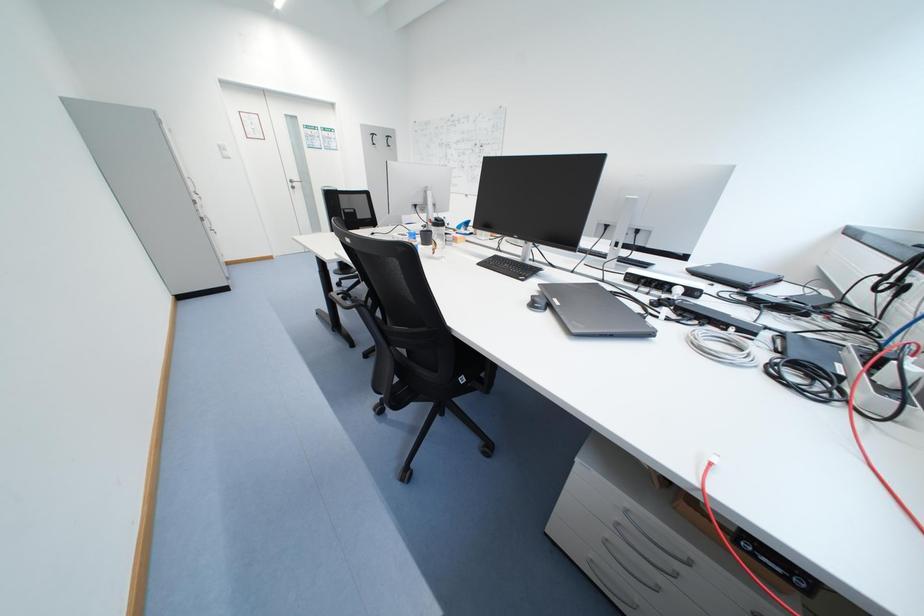
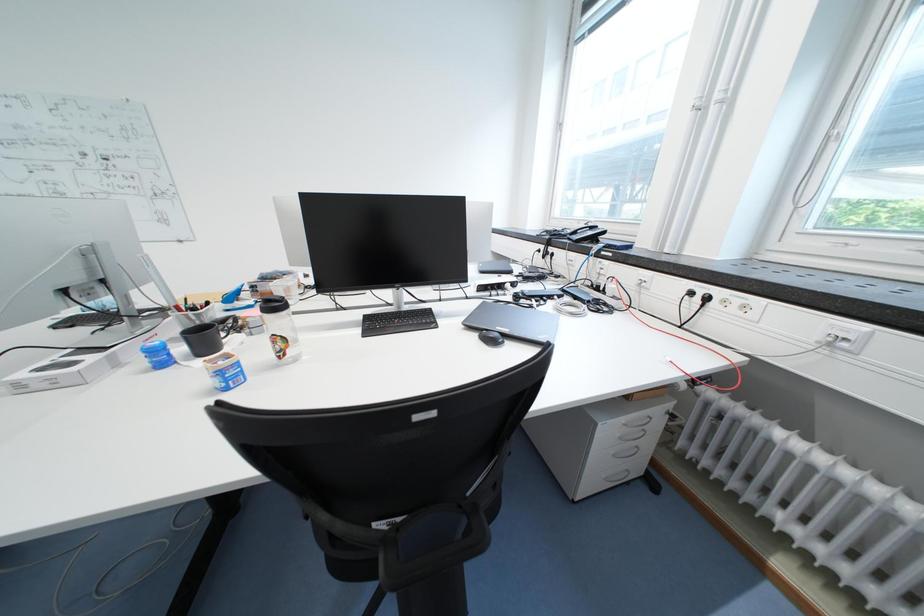
Question: The camera is either moving clockwise (left) or counter-clockwise (right) around the object. The first image is from the beginning of the video and the second image is from the end. Is the camera moving left or right when shooting the video?

Choices:
 (A) Left
 (B) Right

Answer: (A)